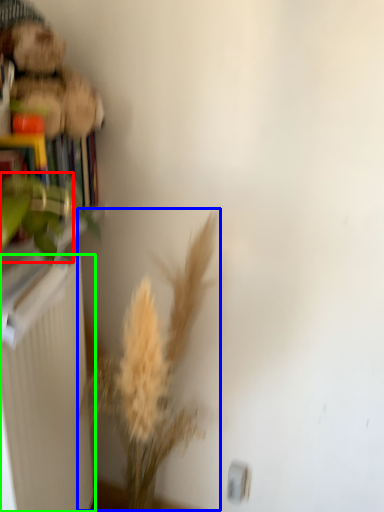
Question: Which object is positioned farthest from plant (highlighted by a red box)? Select from floral arrangement (highlighted by a blue box) and radiator (highlighted by a green box).

Choices:
 (A) floral arrangement
 (B) radiator

Answer: (A)